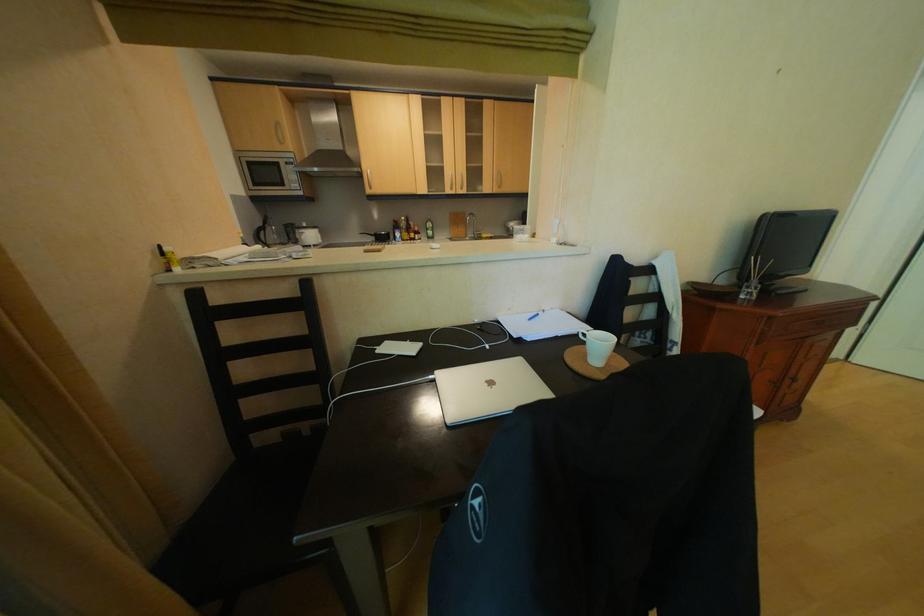
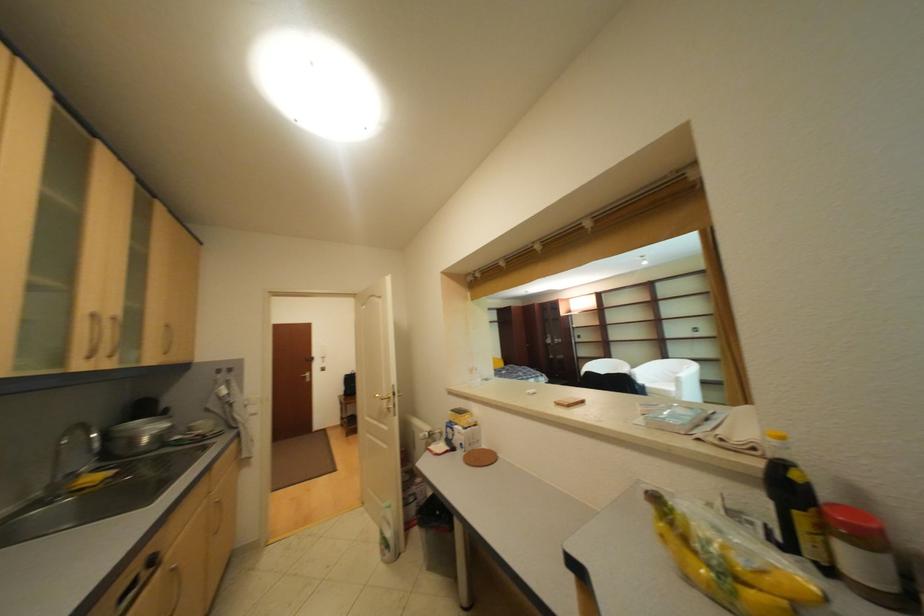
The point at (x=464, y=190) is marked in the first image. Where is the corresponding point in the second image?

(101, 359)